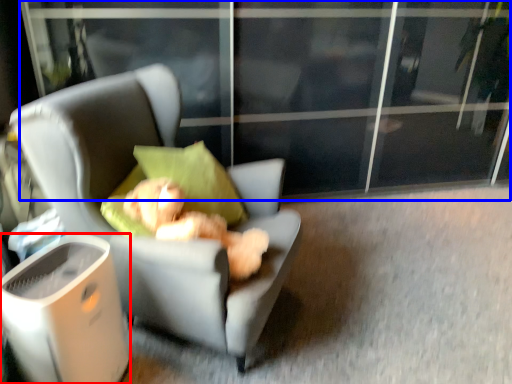
Question: Which point is closer to the camera, trash bin/can (highlighted by a red box) or screen door (highlighted by a blue box)?

Choices:
 (A) trash bin/can
 (B) screen door

Answer: (A)